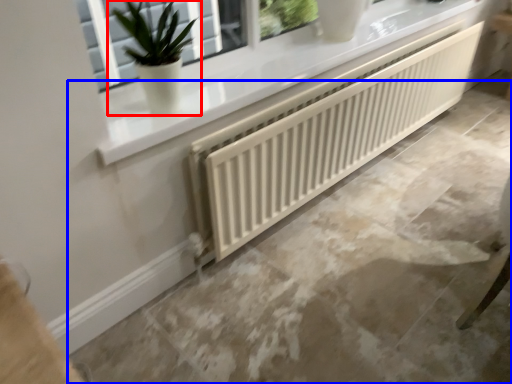
Question: Which of the following is the farthest to the observer, houseplant (highlighted by a red box) or concrete (highlighted by a blue box)?

Choices:
 (A) houseplant
 (B) concrete

Answer: (A)